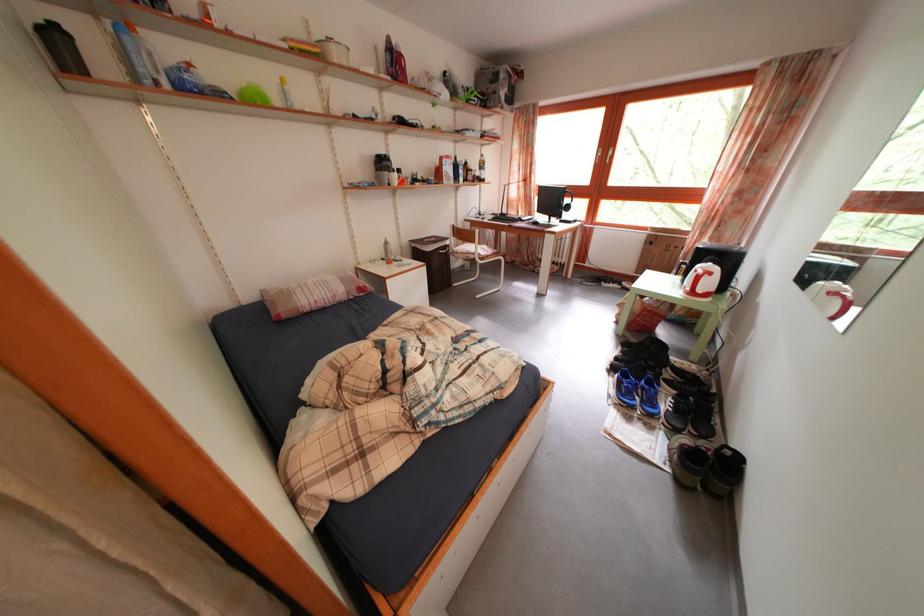
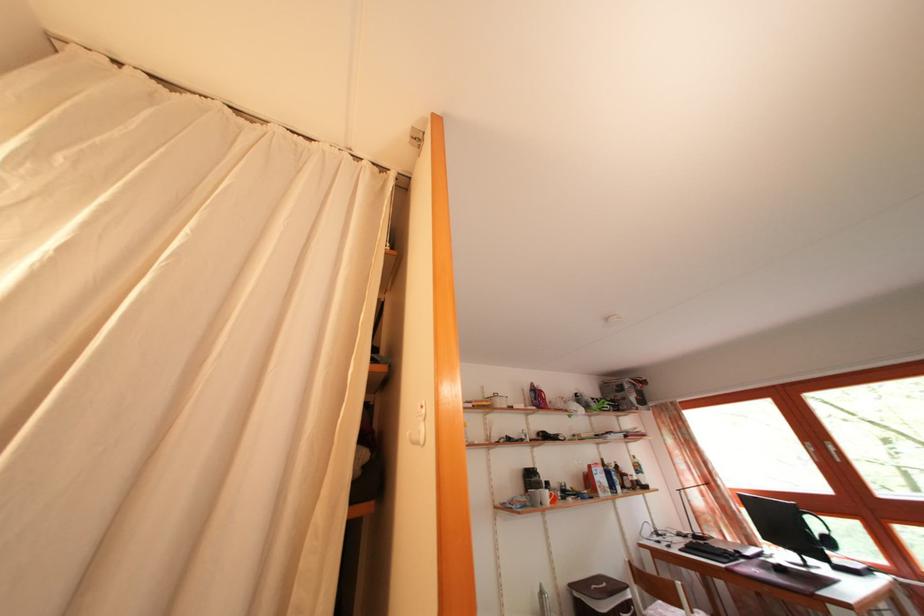
The images are taken continuously from a first-person perspective. In which direction is your viewpoint rotating?

The camera rotated toward left-up.